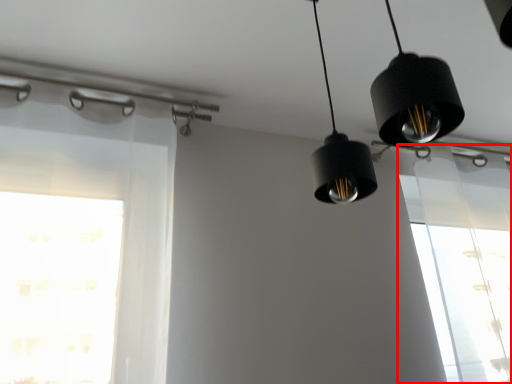
Question: Observing the image, what is the correct spatial positioning of window (annotated by the red box) in reference to lighting?

Choices:
 (A) right
 (B) left

Answer: (A)